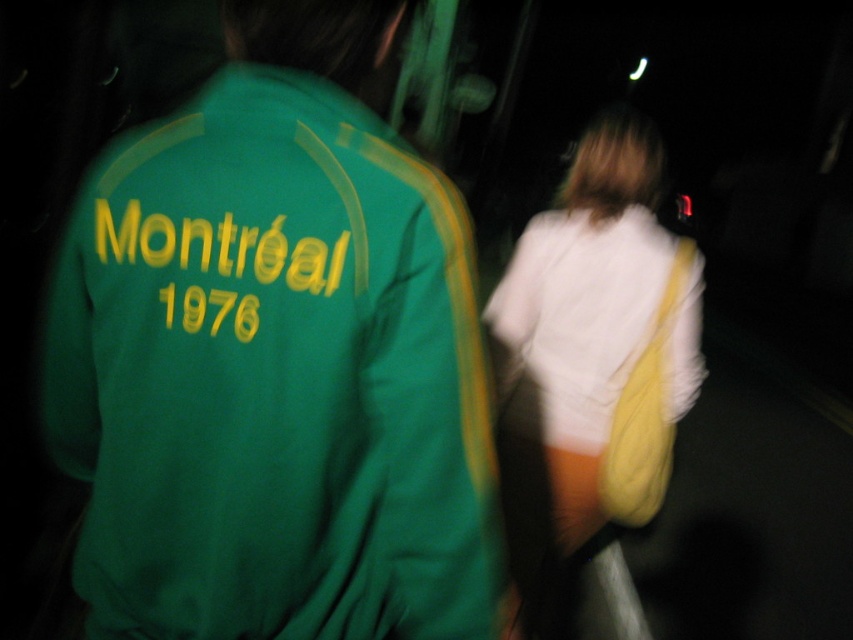
Can you confirm if green fabric jacket at left is taller than white fabric bag at upper right?

No, green fabric jacket at left is not taller than white fabric bag at upper right.

Measure the distance between point (268, 369) and camera.

They are 37.00 inches apart.

In order to click on green fabric jacket at left in this screenshot , I will do `click(274, 360)`.

Measure the distance between point (573, 464) and camera.

They are 2.15 meters apart.

Which is more to the left, white fabric bag at upper right or white soft sweatshirt at right?

Positioned to the left is white soft sweatshirt at right.

Who is more forward, (x=672, y=314) or (x=564, y=342)?

Positioned in front is point (x=672, y=314).

Locate an element on the screen. white fabric bag at upper right is located at coordinates (590, 358).

Which is below, green fabric jacket at left or white soft sweatshirt at right?

green fabric jacket at left is below.

Is green fabric jacket at left behind white soft sweatshirt at right?

No, green fabric jacket at left is closer to the viewer.

Which is behind, point (419, 164) or point (512, 324)?

The point (512, 324) is more distant.

What are the coordinates of `green fabric jacket at left` in the screenshot? It's located at (274, 360).